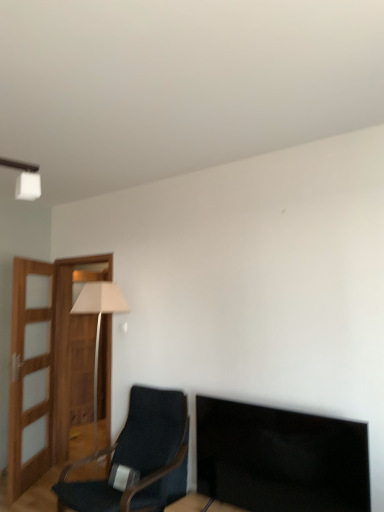
Question: From the image's perspective, is matte beige lamp at left located beneath dark blue fabric chair at lower left?

Choices:
 (A) no
 (B) yes

Answer: (A)

Question: From a real-world perspective, is matte beige lamp at left positioned over dark blue fabric chair at lower left based on gravity?

Choices:
 (A) no
 (B) yes

Answer: (B)

Question: Can you confirm if matte beige lamp at left is wider than dark blue fabric chair at lower left?

Choices:
 (A) yes
 (B) no

Answer: (B)

Question: Considering the relative positions of matte beige lamp at left and dark blue fabric chair at lower left in the image provided, is matte beige lamp at left to the right of dark blue fabric chair at lower left from the viewer's perspective?

Choices:
 (A) no
 (B) yes

Answer: (A)

Question: Can you confirm if matte beige lamp at left is thinner than dark blue fabric chair at lower left?

Choices:
 (A) yes
 (B) no

Answer: (A)

Question: Does matte beige lamp at left come behind dark blue fabric chair at lower left?

Choices:
 (A) no
 (B) yes

Answer: (B)

Question: Is dark blue fabric chair at lower left facing away from matte beige lamp at left?

Choices:
 (A) no
 (B) yes

Answer: (A)

Question: Is dark blue fabric chair at lower left at the left side of matte beige lamp at left?

Choices:
 (A) no
 (B) yes

Answer: (A)

Question: Considering the relative sizes of dark blue fabric chair at lower left and matte beige lamp at left in the image provided, is dark blue fabric chair at lower left thinner than matte beige lamp at left?

Choices:
 (A) yes
 (B) no

Answer: (B)

Question: From the image's perspective, is dark blue fabric chair at lower left under matte beige lamp at left?

Choices:
 (A) no
 (B) yes

Answer: (B)

Question: Is matte beige lamp at left surrounded by dark blue fabric chair at lower left?

Choices:
 (A) yes
 (B) no

Answer: (B)

Question: Is dark blue fabric chair at lower left behind matte beige lamp at left?

Choices:
 (A) yes
 (B) no

Answer: (B)

Question: Is dark blue fabric chair at lower left wider or thinner than matte beige lamp at left?

Choices:
 (A) wide
 (B) thin

Answer: (A)